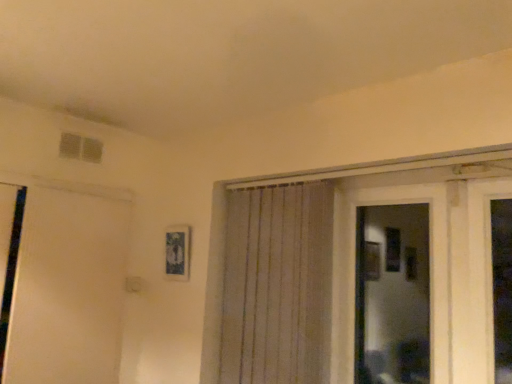
What is the approximate width of white textured curtain at center?

white textured curtain at center is 3.16 inches wide.

This screenshot has width=512, height=384. What do you see at coordinates (68, 290) in the screenshot? I see `white matte door at left` at bounding box center [68, 290].

In order to face transparent glass door at center, should I rotate leftwards or rightwards?

It's best to rotate right around 17.444 degrees.

Find the location of a particular element. The image size is (512, 384). white textured curtain at center is located at coordinates (277, 285).

In the image, is white textured curtain at center on the left side or the right side of white matte door at left?

Based on their positions, white textured curtain at center is located to the right of white matte door at left.

Looking at this image, is the position of white textured curtain at center less distant than that of white matte door at left?

Yes, it is.

In terms of height, does white matte door at left look taller or shorter compared to transparent glass door at center?

Clearly, white matte door at left is taller compared to transparent glass door at center.

Which object is further away from the camera, white matte door at left or transparent glass door at center?

white matte door at left is further away from the camera.

Would you say white matte door at left contains transparent glass door at center?

No, transparent glass door at center is located outside of white matte door at left.

Which object is thinner, white matte door at left or transparent glass door at center?

Thinner between the two is transparent glass door at center.

Consider the image. From a real-world perspective, is transparent glass door at center beneath white textured curtain at center?

→ Actually, transparent glass door at center is physically above white textured curtain at center in the real world.

Based on the photo, which object is positioned more to the left, transparent glass door at center or white textured curtain at center?

Positioned to the left is white textured curtain at center.

From the picture: Looking at their sizes, would you say transparent glass door at center is wider or thinner than white textured curtain at center?

In the image, transparent glass door at center appears to be more narrow than white textured curtain at center.

Can you tell me how much transparent glass door at center and white textured curtain at center differ in facing direction?

There is a 0.00319-degree angle between the facing directions of transparent glass door at center and white textured curtain at center.

Who is taller, transparent glass door at center or white matte door at left?

With more height is white matte door at left.

From the image's perspective, does transparent glass door at center appear higher than white matte door at left?

Yes, from the image's perspective, transparent glass door at center is on top of white matte door at left.

Between point (376, 345) and point (128, 205), which one is positioned behind?

Positioned behind is point (376, 345).

Considering the sizes of transparent glass door at center and white matte door at left in the image, is transparent glass door at center wider or thinner than white matte door at left?

Clearly, transparent glass door at center has less width compared to white matte door at left.

How many degrees apart are the facing directions of white textured curtain at center and transparent glass door at center?

The facing directions of white textured curtain at center and transparent glass door at center are 0.00319 degrees apart.

Considering the relative sizes of white textured curtain at center and transparent glass door at center in the image provided, is white textured curtain at center thinner than transparent glass door at center?

No.

From the image's perspective, who appears lower, white textured curtain at center or transparent glass door at center?

white textured curtain at center appears lower in the image.

Is white textured curtain at center positioned in front of transparent glass door at center?

No, the depth of white textured curtain at center is greater than that of transparent glass door at center.

From the picture: Is white matte door at left wider or thinner than white textured curtain at center?

Clearly, white matte door at left has more width compared to white textured curtain at center.

From the image's perspective, relative to white textured curtain at center, is white matte door at left above or below?

Based on their image positions, white matte door at left is located beneath white textured curtain at center.

Is white matte door at left not inside white textured curtain at center?

Indeed, white matte door at left is completely outside white textured curtain at center.

There is a white matte door at left. Where is `curtain above it (from a real-world perspective)`? The height and width of the screenshot is (384, 512). curtain above it (from a real-world perspective) is located at coordinates (277, 285).

What are the coordinates of `door that appears on the left of transparent glass door at center` in the screenshot? It's located at (68, 290).

Looking at this image, from the image, which object appears to be nearer to transparent glass door at center, white matte door at left or white textured curtain at center?

white textured curtain at center is closer to transparent glass door at center.

Considering their positions, is transparent glass door at center positioned further to white matte door at left than white textured curtain at center?

transparent glass door at center is further to white matte door at left.

Which object lies further to the anchor point white textured curtain at center, white matte door at left or transparent glass door at center?

Based on the image, transparent glass door at center appears to be further to white textured curtain at center.

When comparing their distances from white textured curtain at center, does transparent glass door at center or white matte door at left seem closer?

white matte door at left is positioned closer to the anchor white textured curtain at center.

When comparing their distances from transparent glass door at center, does white textured curtain at center or white matte door at left seem further?

Among the two, white matte door at left is located further to transparent glass door at center.

From the image, which object appears to be nearer to white matte door at left, white textured curtain at center or transparent glass door at center?

white textured curtain at center.

Find the location of a particular element. curtain between white matte door at left and transparent glass door at center from left to right is located at coordinates (277, 285).